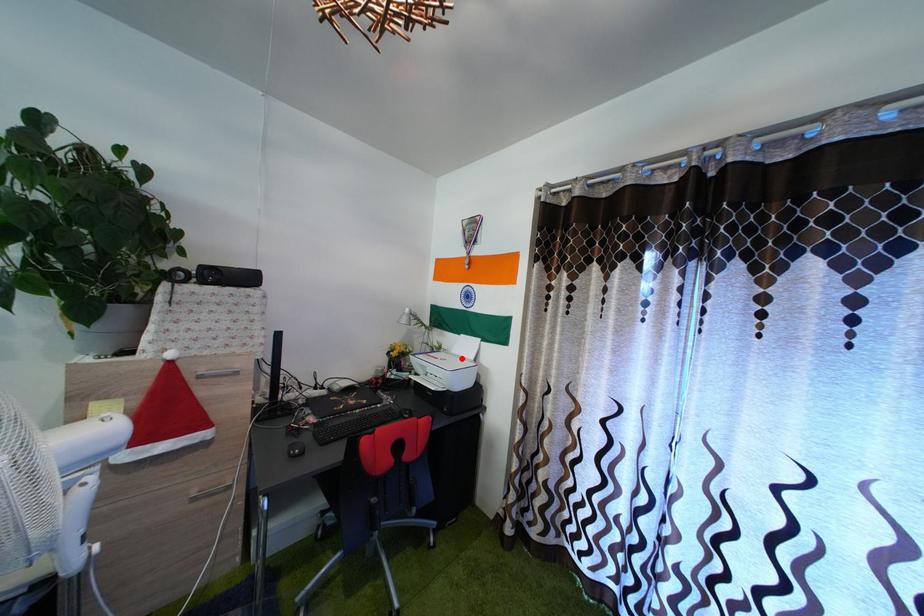
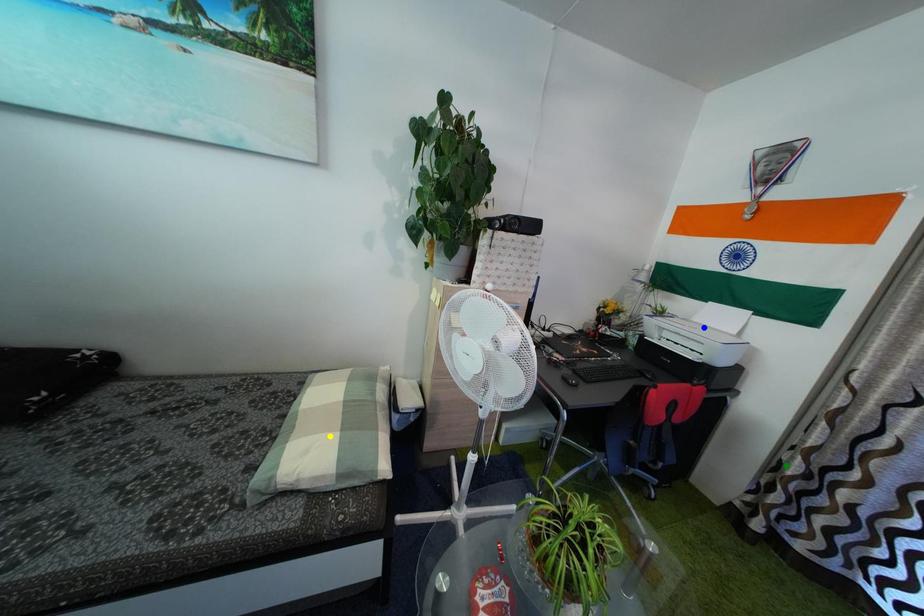
Question: I am providing you with two images of the same scene from different viewpoints. A red point is marked on the first image. You are given multiple points on the second image. Can you choose the point in image 2 that corresponds to the point in image 1?

Choices:
 (A) green point
 (B) blue point
 (C) yellow point

Answer: (B)